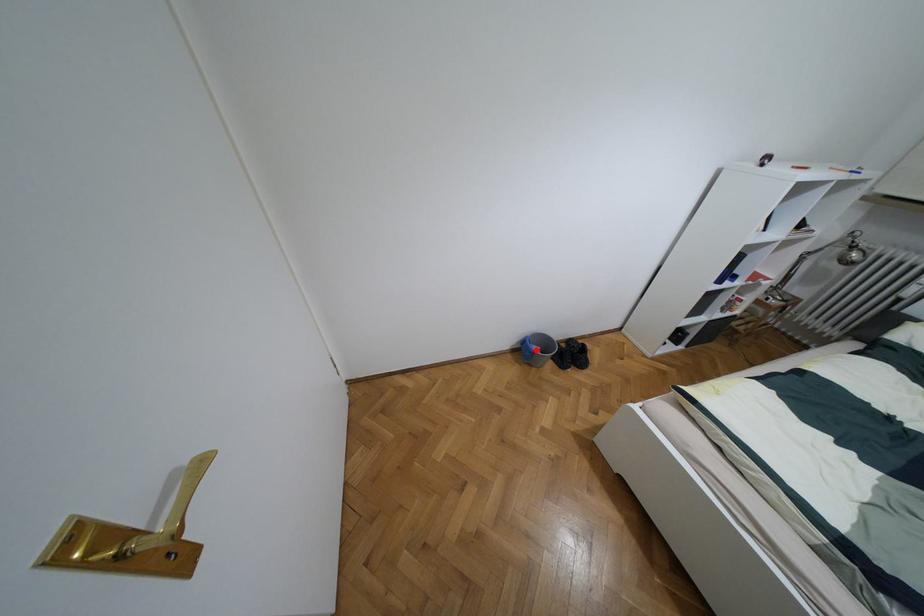
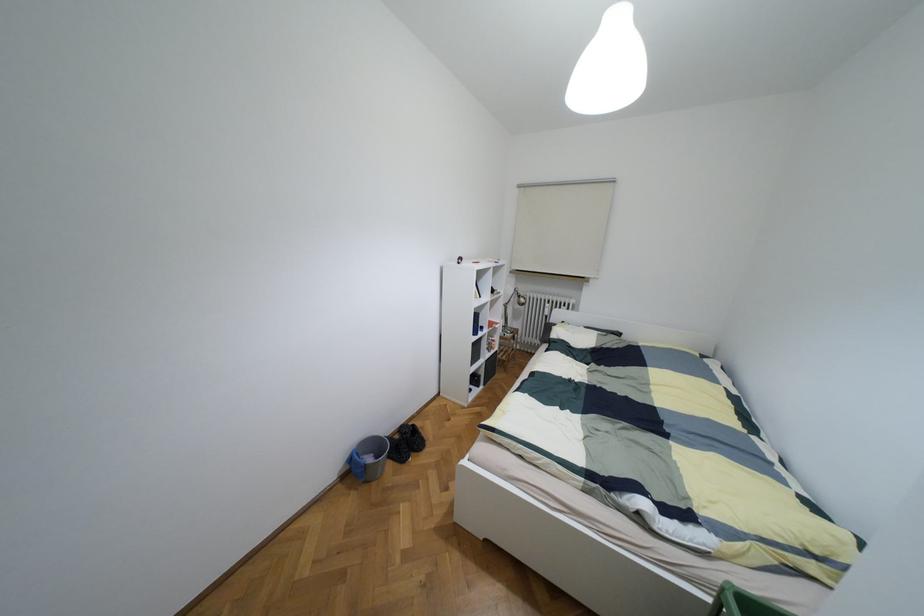
The point at the highlighted location is marked in the first image. Where is the corresponding point in the second image?

(369, 459)